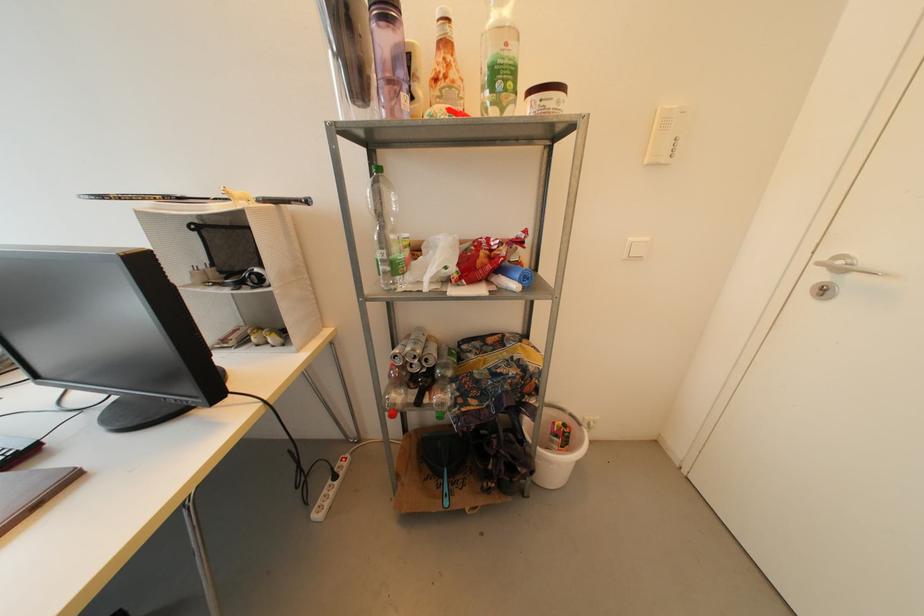
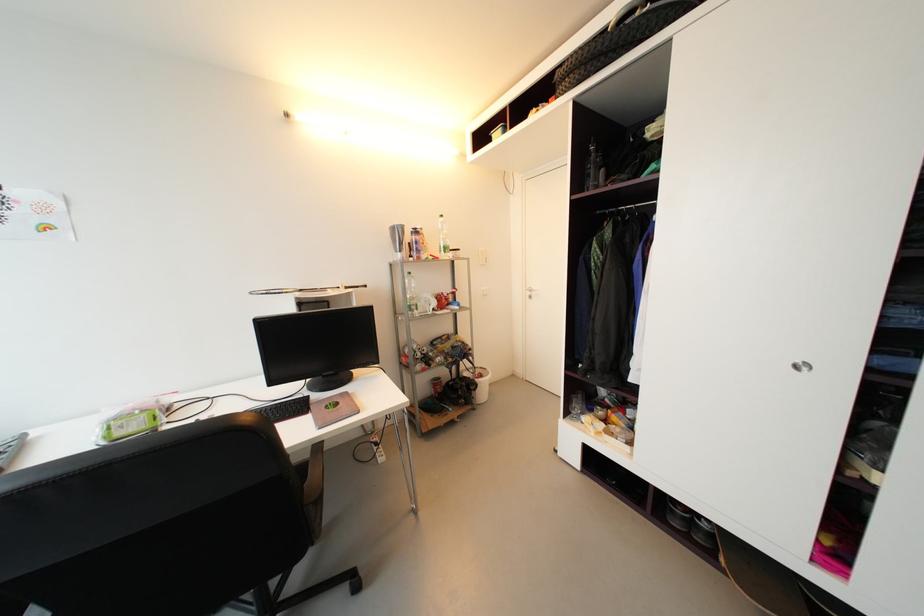
Locate, in the second image, the point that corresponds to point (568, 439) in the first image.

(487, 378)